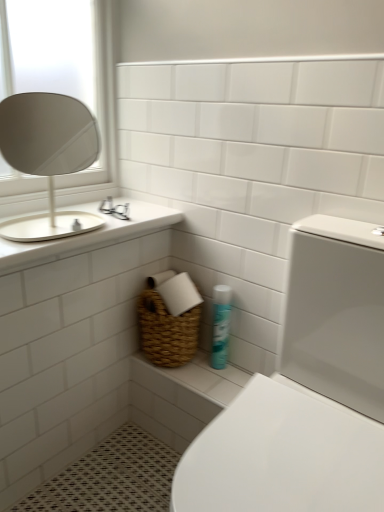
Question: Considering the relative sizes of white ceramic sink at upper left and white glossy toilet at lower right in the image provided, is white ceramic sink at upper left shorter than white glossy toilet at lower right?

Choices:
 (A) yes
 (B) no

Answer: (A)

Question: From a real-world perspective, is white ceramic sink at upper left on white glossy toilet at lower right?

Choices:
 (A) no
 (B) yes

Answer: (B)

Question: From the image's perspective, is white ceramic sink at upper left beneath white glossy toilet at lower right?

Choices:
 (A) no
 (B) yes

Answer: (A)

Question: Is white ceramic sink at upper left not close to white glossy toilet at lower right?

Choices:
 (A) yes
 (B) no

Answer: (A)

Question: Does white ceramic sink at upper left have a larger size compared to white glossy toilet at lower right?

Choices:
 (A) no
 (B) yes

Answer: (A)

Question: Considering the relative positions of white ceramic sink at upper left and white glossy toilet at lower right in the image provided, is white ceramic sink at upper left to the left of white glossy toilet at lower right from the viewer's perspective?

Choices:
 (A) yes
 (B) no

Answer: (A)

Question: From a real-world perspective, is blue glossy spray can at lower center on white glossy toilet at lower right?

Choices:
 (A) no
 (B) yes

Answer: (A)

Question: Considering the relative sizes of blue glossy spray can at lower center and white glossy toilet at lower right in the image provided, is blue glossy spray can at lower center smaller than white glossy toilet at lower right?

Choices:
 (A) no
 (B) yes

Answer: (B)

Question: Is white glossy toilet at lower right at the back of blue glossy spray can at lower center?

Choices:
 (A) no
 (B) yes

Answer: (A)

Question: From the image's perspective, does blue glossy spray can at lower center appear higher than white glossy toilet at lower right?

Choices:
 (A) no
 (B) yes

Answer: (B)

Question: Does blue glossy spray can at lower center have a lesser height compared to white glossy toilet at lower right?

Choices:
 (A) no
 (B) yes

Answer: (B)

Question: Is the depth of blue glossy spray can at lower center greater than that of white glossy toilet at lower right?

Choices:
 (A) no
 (B) yes

Answer: (B)

Question: Can you confirm if blue glossy spray can at lower center is taller than white ceramic sink at upper left?

Choices:
 (A) no
 (B) yes

Answer: (A)